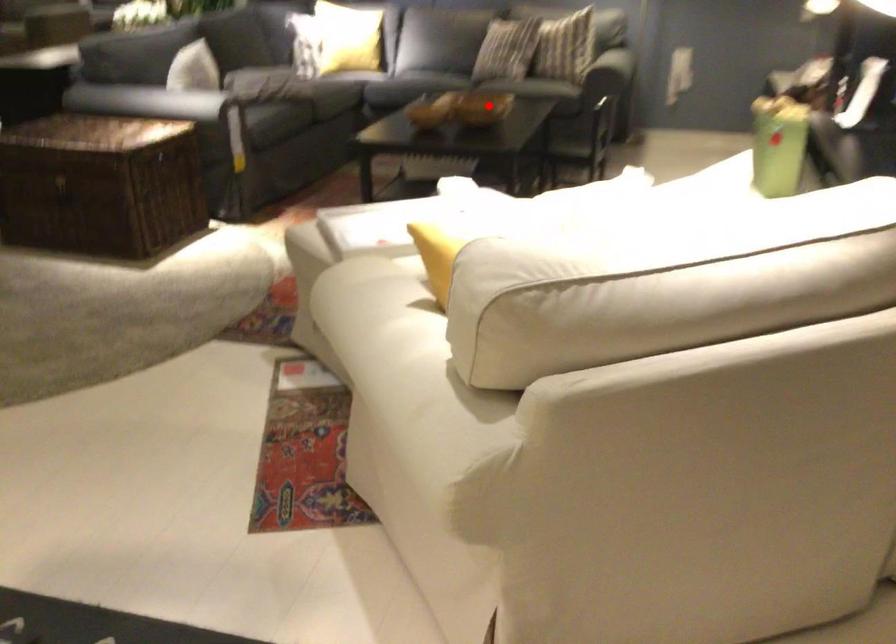
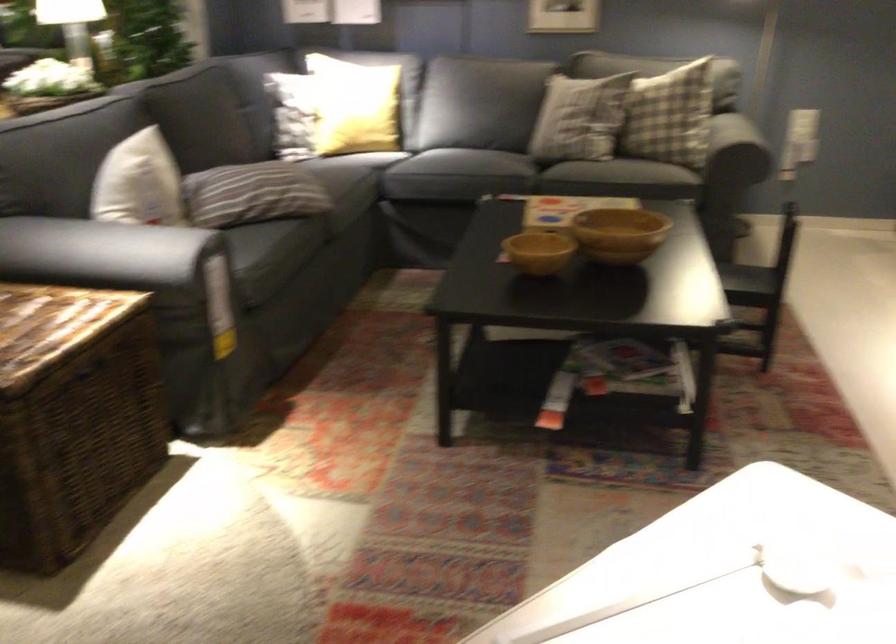
Question: I am providing you with two images of the same scene from different viewpoints. Given a red point in image1, look at the same physical point in image2. Is it:

Choices:
 (A) Closer to the viewpoint
 (B) Farther from the viewpoint

Answer: (A)